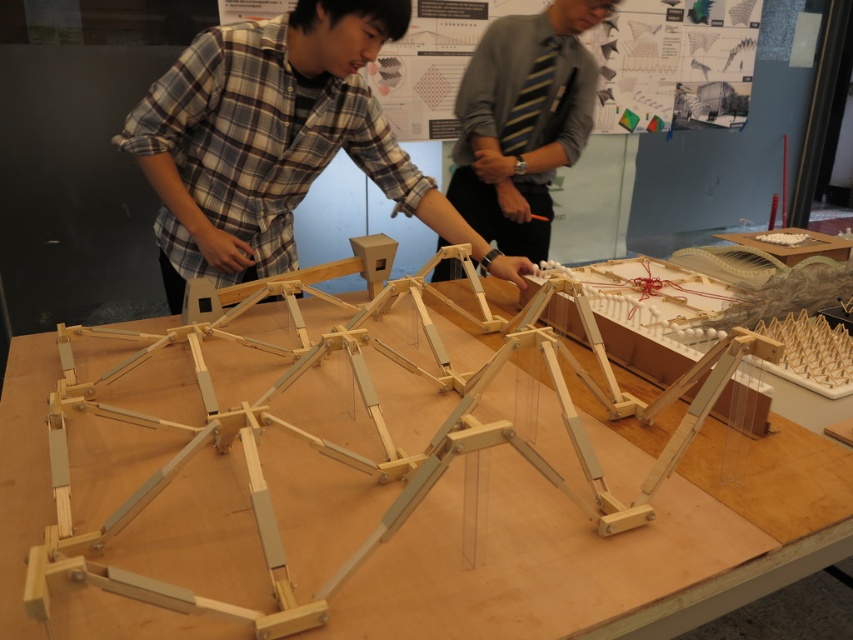
You are a GUI agent. You are given a task and a screenshot of the screen. Output one action in this format:
    pyautogui.click(x=<x>, y=<y>)
    Task: Click on the wooden frame at center
    The width and height of the screenshot is (853, 640).
    Given the screenshot: What is the action you would take?
    pyautogui.click(x=383, y=484)

Is wooden frame at center bigger than plaid shirt at center?

Indeed, wooden frame at center has a larger size compared to plaid shirt at center.

Who is more distant from viewer, (300, 550) or (148, 148)?

The point (148, 148) is behind.

Find the location of `wooden frame at center`. wooden frame at center is located at coordinates (383, 484).

Between wooden frame at center and striped tie at center, which one is positioned higher?

Positioned higher is striped tie at center.

At what (x,y) coordinates should I click in order to perform the action: click on wooden frame at center. Please return your answer as a coordinate pair (x, y). This screenshot has height=640, width=853. Looking at the image, I should click on (383, 484).

Who is positioned more to the right, plaid shirt at center or striped tie at center?

From the viewer's perspective, striped tie at center appears more on the right side.

Is plaid shirt at center positioned at the back of striped tie at center?

No, plaid shirt at center is in front of striped tie at center.

Find the location of a particular element. The height and width of the screenshot is (640, 853). plaid shirt at center is located at coordinates (274, 141).